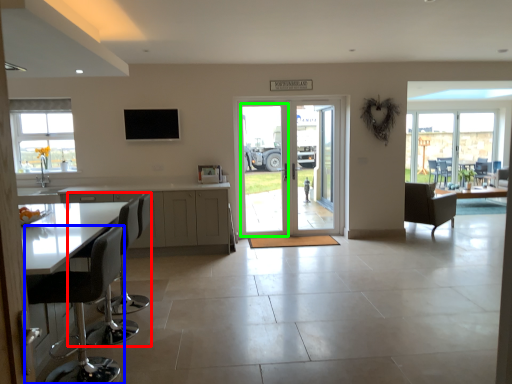
Question: Which is nearer to the chair (highlighted by a red box)? chair (highlighted by a blue box) or screen door (highlighted by a green box).

Choices:
 (A) chair
 (B) screen door

Answer: (A)